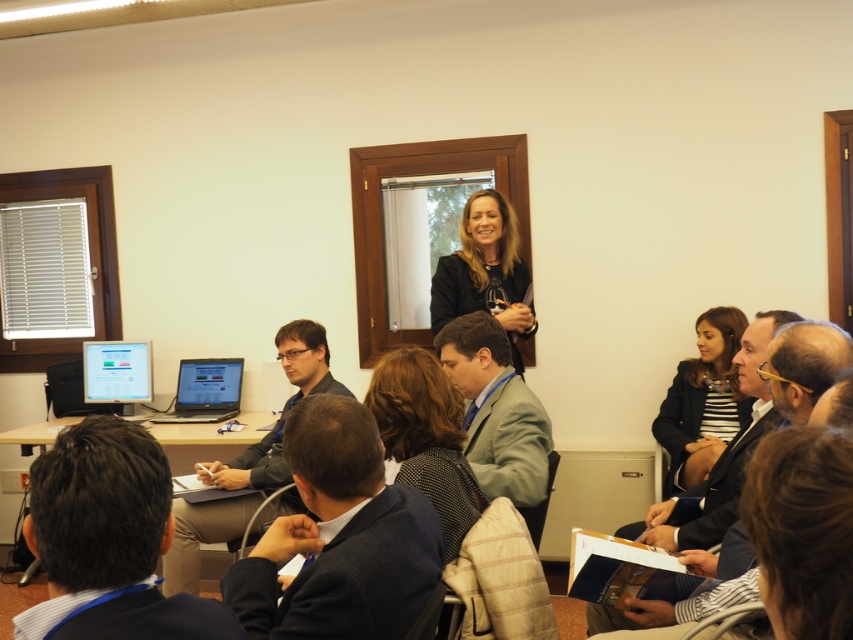
Question: Which point is closer to the camera?

Choices:
 (A) satin black laptop at center
 (B) striped fabric jacket at center

Answer: (B)

Question: Does striped fabric jacket at center appear under satin black laptop at center?

Choices:
 (A) no
 (B) yes

Answer: (A)

Question: Considering the real-world distances, which object is closest to the striped fabric jacket at center?

Choices:
 (A) black leather jacket at upper center
 (B) dark brown hair at center
 (C) satin black laptop at center

Answer: (A)

Question: Which of the following is the closest to the observer?

Choices:
 (A) (701, 474)
 (B) (234, 371)

Answer: (A)

Question: Is the position of dark brown hair at center less distant than that of satin black laptop at center?

Choices:
 (A) yes
 (B) no

Answer: (A)

Question: Can you confirm if dark brown hair at center is positioned to the left of black leather jacket at upper center?

Choices:
 (A) no
 (B) yes

Answer: (B)